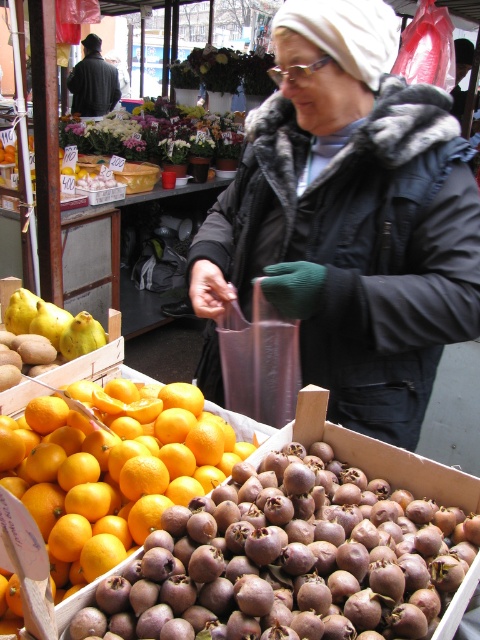
Is the position of white fur-trimmed coat at center less distant than that of smooth orange at center?

That is False.

Between white fur-trimmed coat at center and smooth orange at center, which one is positioned lower?

smooth orange at center is lower down.

What do you see at coordinates (350, 218) in the screenshot?
I see `white fur-trimmed coat at center` at bounding box center [350, 218].

I want to click on white fur-trimmed coat at center, so click(x=350, y=218).

Is white fur-trimmed coat at center closer to the viewer compared to brown matte medlar at lower center?

No, it is behind brown matte medlar at lower center.

Is white fur-trimmed coat at center smaller than brown matte medlar at lower center?

No.

Image resolution: width=480 pixels, height=640 pixels. Find the location of `white fur-trimmed coat at center`. white fur-trimmed coat at center is located at coordinates (350, 218).

Can you confirm if brown matte medlar at lower center is positioned to the right of smooth orange at center?

Indeed, brown matte medlar at lower center is positioned on the right side of smooth orange at center.

Which of these two, brown matte medlar at lower center or smooth orange at center, stands shorter?

brown matte medlar at lower center is shorter.

The width and height of the screenshot is (480, 640). Identify the location of brown matte medlar at lower center. (268, 557).

Find the location of a particular element. brown matte medlar at lower center is located at coordinates click(268, 557).